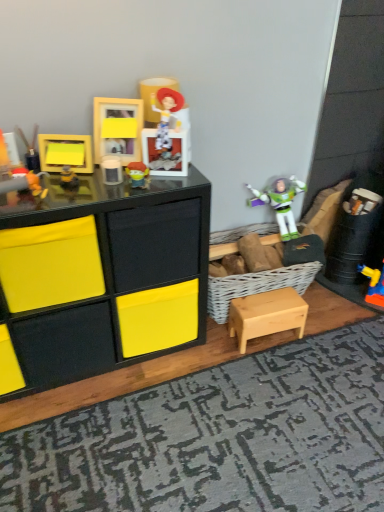
Locate an element on the screen. The height and width of the screenshot is (512, 384). spots to the right of light wood table at lower right is located at coordinates (324, 337).